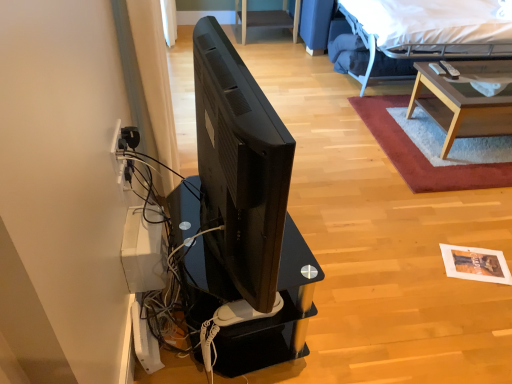
Question: Is light brown wooden table at upper right taller than black matte television at center?

Choices:
 (A) no
 (B) yes

Answer: (A)

Question: Can you confirm if light brown wooden table at upper right is positioned to the right of black matte television at center?

Choices:
 (A) no
 (B) yes

Answer: (B)

Question: Would you consider light brown wooden table at upper right to be distant from black matte television at center?

Choices:
 (A) yes
 (B) no

Answer: (A)

Question: Is light brown wooden table at upper right completely or partially outside of black matte television at center?

Choices:
 (A) no
 (B) yes

Answer: (B)

Question: From a real-world perspective, does light brown wooden table at upper right stand above black matte television at center?

Choices:
 (A) no
 (B) yes

Answer: (A)

Question: Looking at their shapes, would you say black matte television at center is wider or thinner than black glossy desk at center?

Choices:
 (A) wide
 (B) thin

Answer: (B)

Question: Based on their positions, is black matte television at center located to the left or right of black glossy desk at center?

Choices:
 (A) left
 (B) right

Answer: (A)

Question: In terms of size, does black matte television at center appear bigger or smaller than black glossy desk at center?

Choices:
 (A) big
 (B) small

Answer: (B)

Question: From the image's perspective, is black matte television at center positioned above or below black glossy desk at center?

Choices:
 (A) above
 (B) below

Answer: (A)

Question: Is point (128, 185) closer or farther from the camera than point (430, 26)?

Choices:
 (A) closer
 (B) farther

Answer: (A)

Question: In the image, is white plastic electric outlet at left positioned in front of or behind white fabric bed at upper right?

Choices:
 (A) front
 (B) behind

Answer: (A)

Question: From the image's perspective, is white plastic electric outlet at left positioned above or below white fabric bed at upper right?

Choices:
 (A) above
 (B) below

Answer: (B)

Question: Would you say white plastic electric outlet at left is to the left or to the right of white fabric bed at upper right in the picture?

Choices:
 (A) left
 (B) right

Answer: (A)

Question: Is white fabric bed at upper right taller or shorter than black glossy desk at center?

Choices:
 (A) short
 (B) tall

Answer: (B)

Question: Is white fabric bed at upper right bigger or smaller than black glossy desk at center?

Choices:
 (A) small
 (B) big

Answer: (B)